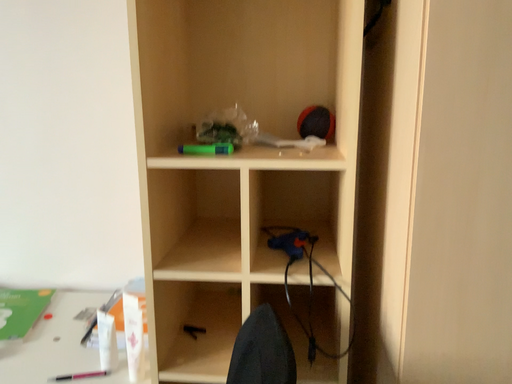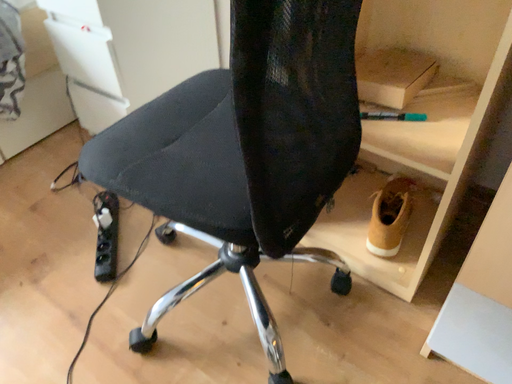
Question: How did the camera likely rotate when shooting the video?

Choices:
 (A) rotated upward
 (B) rotated downward

Answer: (B)